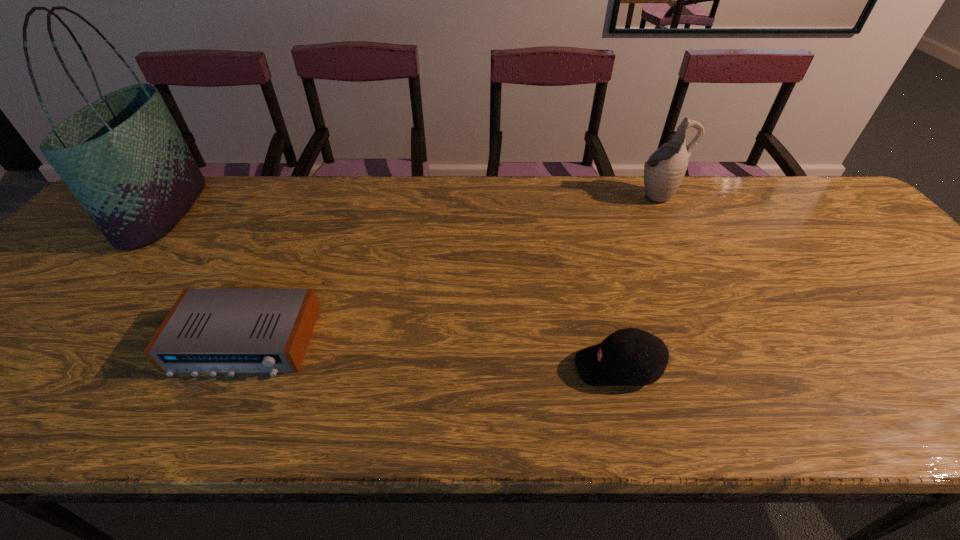
The height and width of the screenshot is (540, 960). In order to click on the leftmost object in this screenshot , I will do `click(123, 157)`.

This screenshot has height=540, width=960. Find the location of `the tallest object`. the tallest object is located at coordinates (123, 157).

Where is `the rightmost object`? The width and height of the screenshot is (960, 540). the rightmost object is located at coordinates (664, 170).

Identify the location of the second tallest object. This screenshot has height=540, width=960. (664, 170).

Locate an element on the screen. The width and height of the screenshot is (960, 540). baseball cap is located at coordinates (628, 357).

Find the location of `the third object from left to right`. the third object from left to right is located at coordinates (628, 357).

Where is `radio receiver`? The height and width of the screenshot is (540, 960). radio receiver is located at coordinates (212, 331).

The image size is (960, 540). Find the location of `the shortest object`. the shortest object is located at coordinates (212, 331).

Locate an element on the screen. vacant space situated on the front of the tote bag is located at coordinates tap(100, 287).

Where is `free space located 0.130m at the spout of the rightmost object`? This screenshot has width=960, height=540. free space located 0.130m at the spout of the rightmost object is located at coordinates (594, 195).